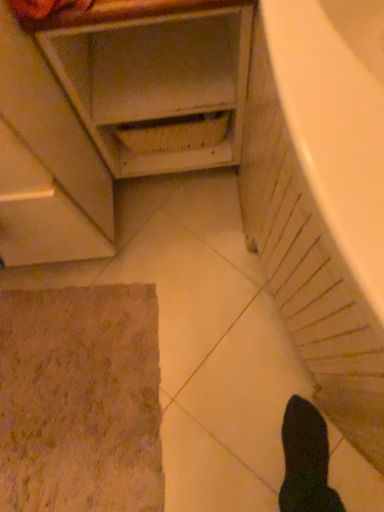
What are the coordinates of `empty space that is ontop of brown textured bath mat at lower left (from a real-world perspective)` in the screenshot? It's located at (72, 397).